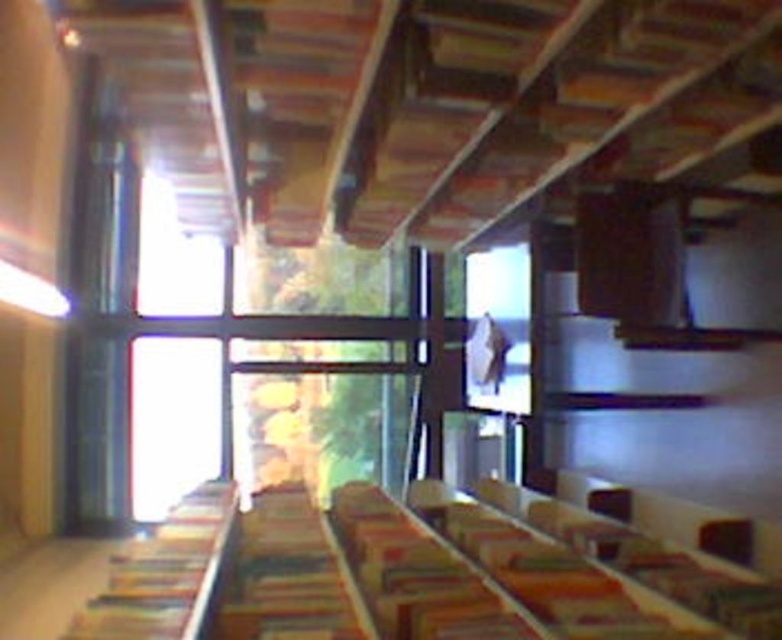
Does multicolored fabric book at center have a larger size compared to hardcover book at left?

Correct, multicolored fabric book at center is larger in size than hardcover book at left.

Does point (239, 596) come in front of point (138, 572)?

No.

Where is `multicolored fabric book at center`? Image resolution: width=782 pixels, height=640 pixels. multicolored fabric book at center is located at coordinates (282, 576).